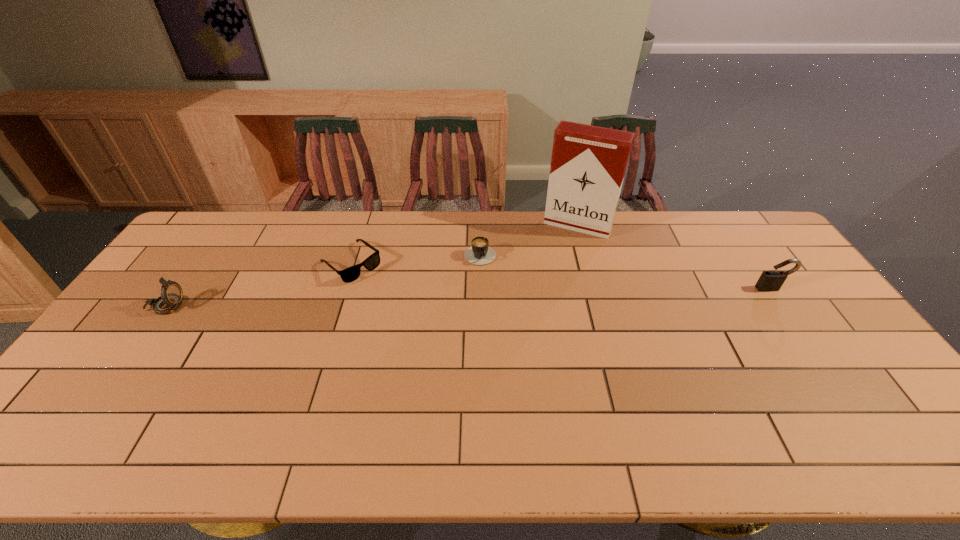
Locate an element on the screen. Image resolution: width=960 pixels, height=540 pixels. vacant space on the desktop that is between the leftmost object and the padlock and is positioned on the front-facing side of the second object from right to left is located at coordinates (547, 295).

Identify the location of vacant space on the desktop that is between the leftmost object and the rightmost object and is positioned on the front-facing side of the sunglasses. (395, 299).

This screenshot has width=960, height=540. Find the location of `vacant space on the desktop that is between the leftmost object and the rightmost object and is positioned with the handle on the side of the third object from right to left`. vacant space on the desktop that is between the leftmost object and the rightmost object and is positioned with the handle on the side of the third object from right to left is located at coordinates (497, 296).